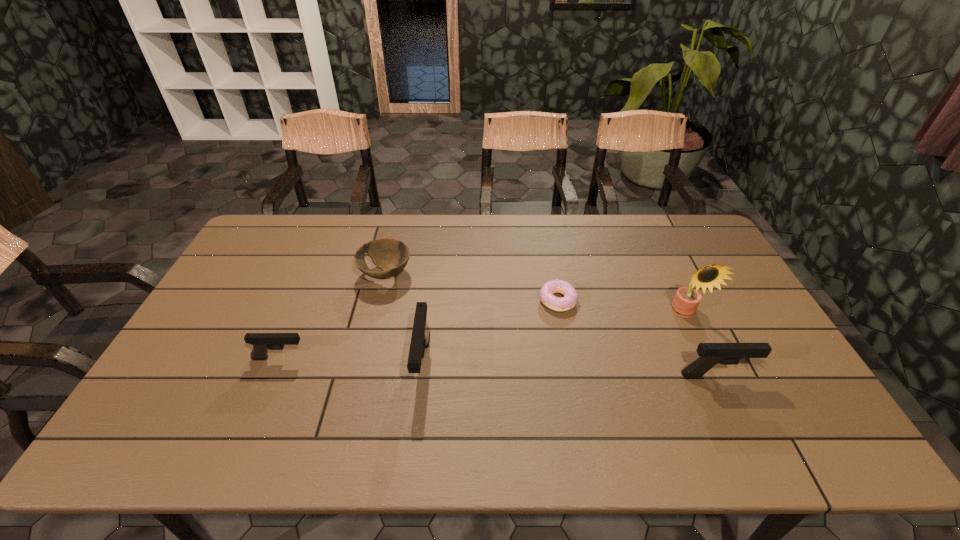
Identify the location of free space between the sunflower and the shortest pistol. The width and height of the screenshot is (960, 540). coord(482,336).

You are a GUI agent. You are given a task and a screenshot of the screen. Output one action in this format:
    pyautogui.click(x=<x>, y=<y>)
    Task: Click on the object identified as the fifth closest to the leftmost pistol
    
    Given the screenshot: What is the action you would take?
    pyautogui.click(x=685, y=303)

Identify which object is the fourth nearest to the doughnut. Please provide its 2D coordinates. Your answer should be formatted as a tuple, i.e. [(x, y)], where the tuple contains the x and y coordinates of a point satisfying the conditions above.

[(391, 255)]

This screenshot has height=540, width=960. I want to click on the closest pistol relative to the leftmost pistol, so click(420, 337).

Locate an element on the screen. The height and width of the screenshot is (540, 960). pistol that is the closest to the leftmost pistol is located at coordinates (420, 337).

At what (x,y) coordinates should I click in order to perform the action: click on vacant point that satisfies the following two spatial constraints: 1. on the face of the sunflower; 2. on the front-facing side of the leftmost pistol. Please return your answer as a coordinate pair (x, y). This screenshot has height=540, width=960. Looking at the image, I should click on (706, 358).

Locate an element on the screen. This screenshot has width=960, height=540. free space that satisfies the following two spatial constraints: 1. on the face of the sunflower; 2. on the front-facing side of the leftmost object is located at coordinates (706, 358).